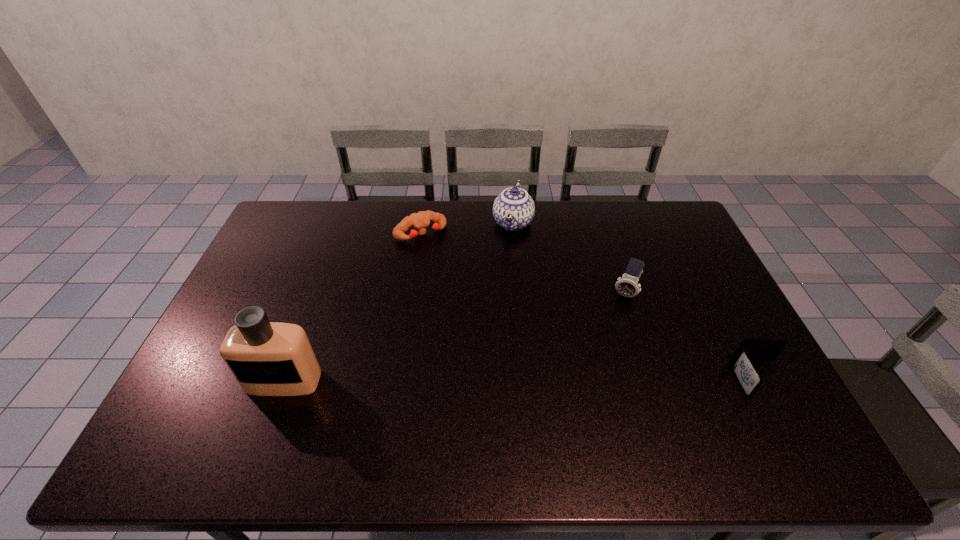
You are a GUI agent. You are given a task and a screenshot of the screen. Output one action in this format:
    pyautogui.click(x=<x>, y=<y>)
    Task: Click on the free point between the leftmost object and the chinaware
    
    Given the screenshot: What is the action you would take?
    pyautogui.click(x=398, y=302)

At what (x,y) coordinates should I click in order to perform the action: click on unoccupied area between the second tallest object and the rightmost object. Please return your answer as a coordinate pair (x, y). Looking at the image, I should click on (636, 301).

You are a GUI agent. You are given a task and a screenshot of the screen. Output one action in this format:
    pyautogui.click(x=<x>, y=<y>)
    Task: Click on the empty space that is in between the fourth object from right to left and the watch
    The width and height of the screenshot is (960, 540).
    Given the screenshot: What is the action you would take?
    pyautogui.click(x=523, y=264)

Image resolution: width=960 pixels, height=540 pixels. I want to click on empty space between the puncher and the second tallest object, so click(x=467, y=228).

Where is `free space between the third object from right to left and the puncher`? The image size is (960, 540). free space between the third object from right to left and the puncher is located at coordinates (467, 228).

Identify the location of free spot between the puncher and the third tallest object. (523, 264).

Locate an element on the screen. The width and height of the screenshot is (960, 540). free space that is in between the third object from left to right and the second object from left to right is located at coordinates (467, 228).

You are a GUI agent. You are given a task and a screenshot of the screen. Output one action in this format:
    pyautogui.click(x=<x>, y=<y>)
    Task: Click on the vacant area that lies between the wallet and the second tallest object
    
    Given the screenshot: What is the action you would take?
    pyautogui.click(x=636, y=301)

You are a GUI agent. You are given a task and a screenshot of the screen. Output one action in this format:
    pyautogui.click(x=<x>, y=<y>)
    Task: Click on the free space between the perfume and the rightmost object
    The height and width of the screenshot is (540, 960).
    Given the screenshot: What is the action you would take?
    pyautogui.click(x=521, y=380)

Where is `object that stands as the fourth closest to the rightmost object`? The width and height of the screenshot is (960, 540). object that stands as the fourth closest to the rightmost object is located at coordinates (267, 358).